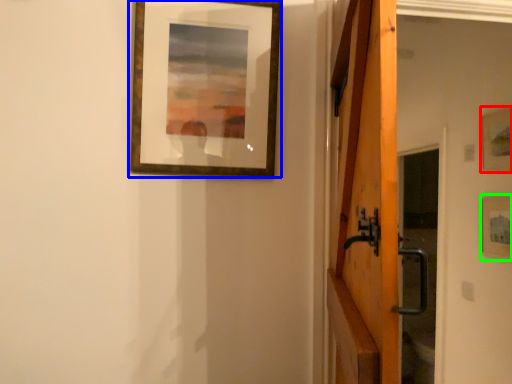
Question: Estimate the real-world distances between objects in this image. Which object is farther from picture frame (highlighted by a red box), picture frame (highlighted by a blue box) or picture frame (highlighted by a green box)?

Choices:
 (A) picture frame
 (B) picture frame

Answer: (A)